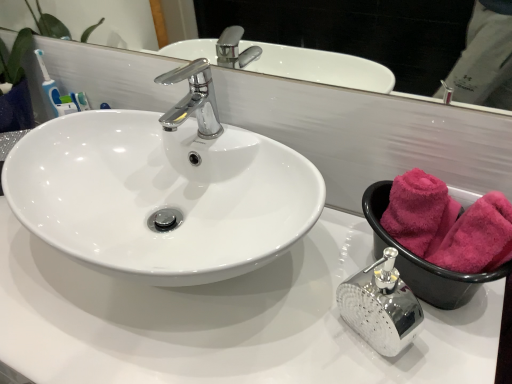
Where is `empty space that is to the right of chrome/metallic faucet at center`? This screenshot has width=512, height=384. empty space that is to the right of chrome/metallic faucet at center is located at coordinates (257, 144).